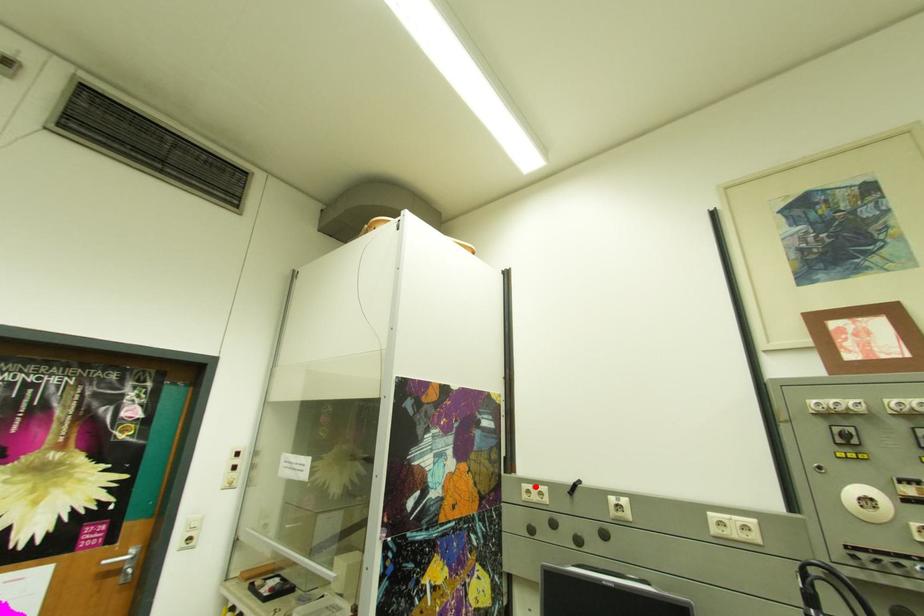
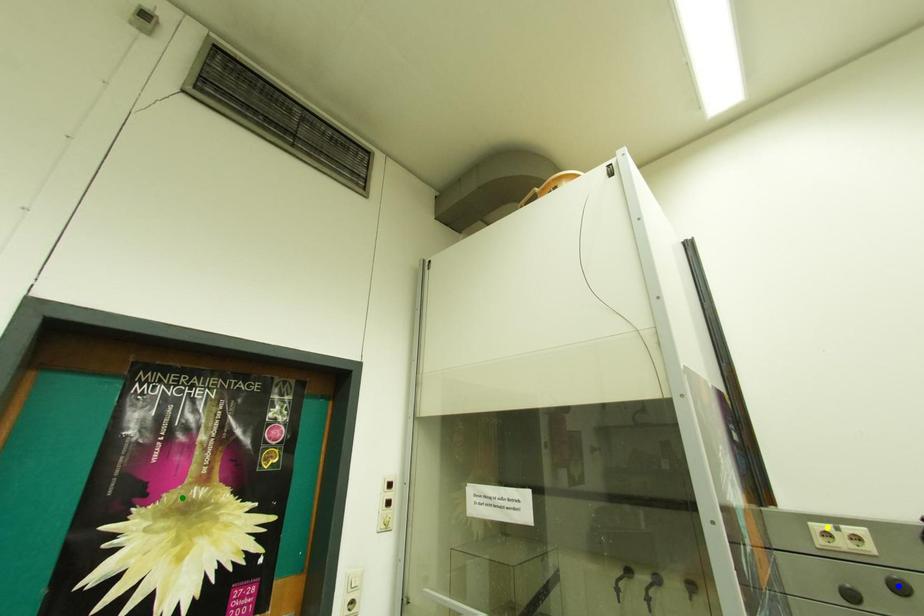
Question: I am providing you with two images of the same scene from different viewpoints. A red point is marked on the first image. You are given multiple points on the second image. Can you choose the point in image 2 that corresponds to the point in image 1?

Choices:
 (A) yellow point
 (B) green point
 (C) blue point

Answer: (A)